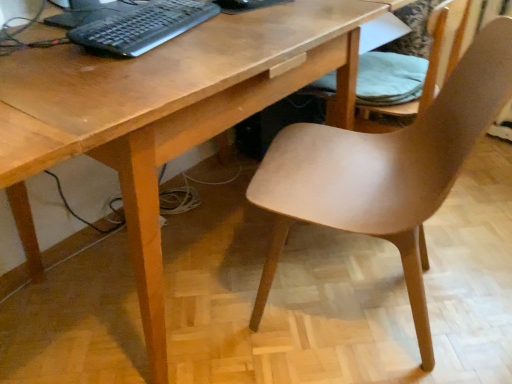
Question: From a real-world perspective, is matte wood chair at center, which is the 1th chair from front to back, beneath matte wood chair at lower right, arranged as the second chair when viewed from the front?

Choices:
 (A) yes
 (B) no

Answer: (A)

Question: Is the depth of matte wood chair at center, arranged as the second chair when viewed from the back, greater than that of matte wood chair at lower right, arranged as the second chair when viewed from the front?

Choices:
 (A) no
 (B) yes

Answer: (A)

Question: Does matte wood chair at center, which is the 1th chair from front to back, have a larger size compared to matte wood chair at lower right, arranged as the second chair when viewed from the front?

Choices:
 (A) no
 (B) yes

Answer: (B)

Question: Considering the relative sizes of matte wood chair at center, which is the 1th chair from front to back, and matte wood chair at lower right, marked as the 1th chair in a back-to-front arrangement, in the image provided, is matte wood chair at center, which is the 1th chair from front to back, taller than matte wood chair at lower right, marked as the 1th chair in a back-to-front arrangement,?

Choices:
 (A) no
 (B) yes

Answer: (B)

Question: Considering the relative sizes of matte wood chair at center, which is the 1th chair from front to back, and matte wood chair at lower right, marked as the 1th chair in a back-to-front arrangement, in the image provided, is matte wood chair at center, which is the 1th chair from front to back, shorter than matte wood chair at lower right, marked as the 1th chair in a back-to-front arrangement,?

Choices:
 (A) no
 (B) yes

Answer: (A)

Question: Can we say matte wood chair at center, which is the 1th chair from front to back, lies outside matte wood chair at lower right, marked as the 1th chair in a back-to-front arrangement?

Choices:
 (A) no
 (B) yes

Answer: (B)

Question: Can you confirm if matte wood chair at center, arranged as the second chair when viewed from the back, is bigger than black plastic keyboard at upper left?

Choices:
 (A) no
 (B) yes

Answer: (B)

Question: Is matte wood chair at center, arranged as the second chair when viewed from the back, positioned far away from black plastic keyboard at upper left?

Choices:
 (A) yes
 (B) no

Answer: (B)

Question: From a real-world perspective, is matte wood chair at center, which is the 1th chair from front to back, below black plastic keyboard at upper left?

Choices:
 (A) yes
 (B) no

Answer: (A)

Question: Is matte wood chair at center, arranged as the second chair when viewed from the back, with black plastic keyboard at upper left?

Choices:
 (A) no
 (B) yes

Answer: (A)

Question: Can you confirm if matte wood chair at center, which is the 1th chair from front to back, is thinner than black plastic keyboard at upper left?

Choices:
 (A) yes
 (B) no

Answer: (B)

Question: Considering the relative sizes of matte wood chair at center, which is the 1th chair from front to back, and black plastic keyboard at upper left in the image provided, is matte wood chair at center, which is the 1th chair from front to back, smaller than black plastic keyboard at upper left?

Choices:
 (A) no
 (B) yes

Answer: (A)

Question: From the image's perspective, is matte wood chair at lower right, marked as the 1th chair in a back-to-front arrangement, on matte wood chair at center, arranged as the second chair when viewed from the back?

Choices:
 (A) yes
 (B) no

Answer: (A)